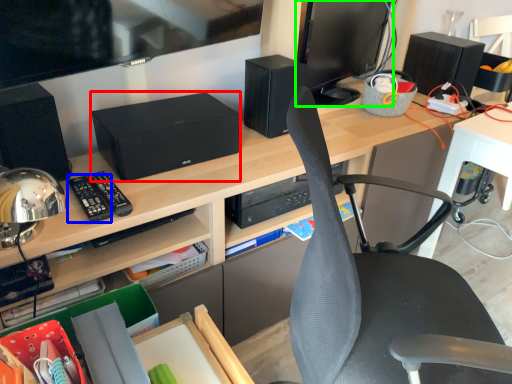
Question: Estimate the real-world distances between objects in this image. Which object is farther from printer (highlighted by a red box), control (highlighted by a blue box) or computer monitor (highlighted by a green box)?

Choices:
 (A) control
 (B) computer monitor

Answer: (B)